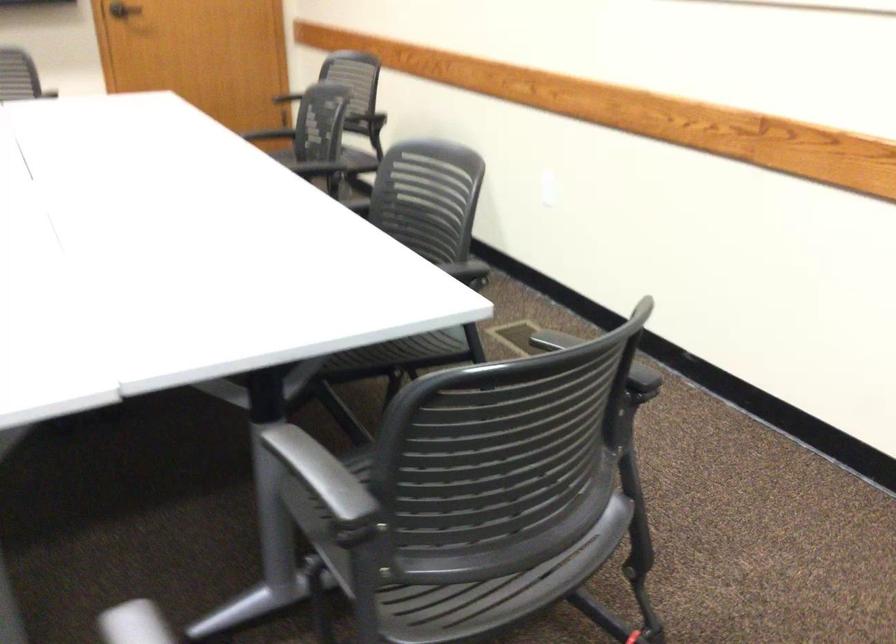
Locate an element on the screen. grey chair armrest is located at coordinates (321, 473).